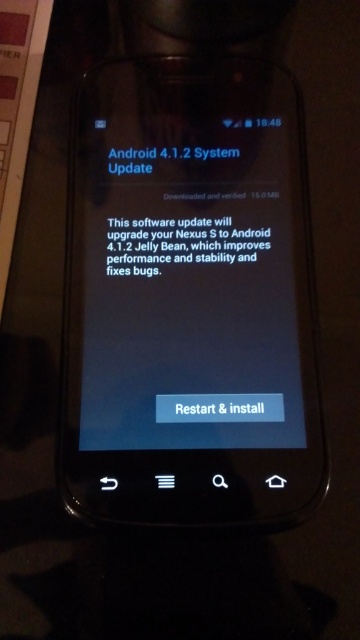
You are looking at the Nexus S smartphone screen showing the Android 4.1.2 update. There are two points marked on the screen. Which point is closer to you, point at coordinates (x=141, y=288) or point at coordinates (x=168, y=260)?

Point at coordinates (x=141, y=288) is closer to the viewer than point at coordinates (x=168, y=260).

You are looking at the Nexus S smartphone screen described. The black matte text at center and blue glossy text at upper center are both visible. Which text is closer to you?

The black matte text at center is closer to you because it is in front of the blue glossy text at upper center.

From the picture: You are holding a Nexus S smartphone and looking at its screen. You notice the blue glossy screen at center and the blue glossy text at upper center. Which of these two elements is closer to your eyes?

The blue glossy screen at center is closer to your eyes because it is in front of the blue glossy text at upper center.